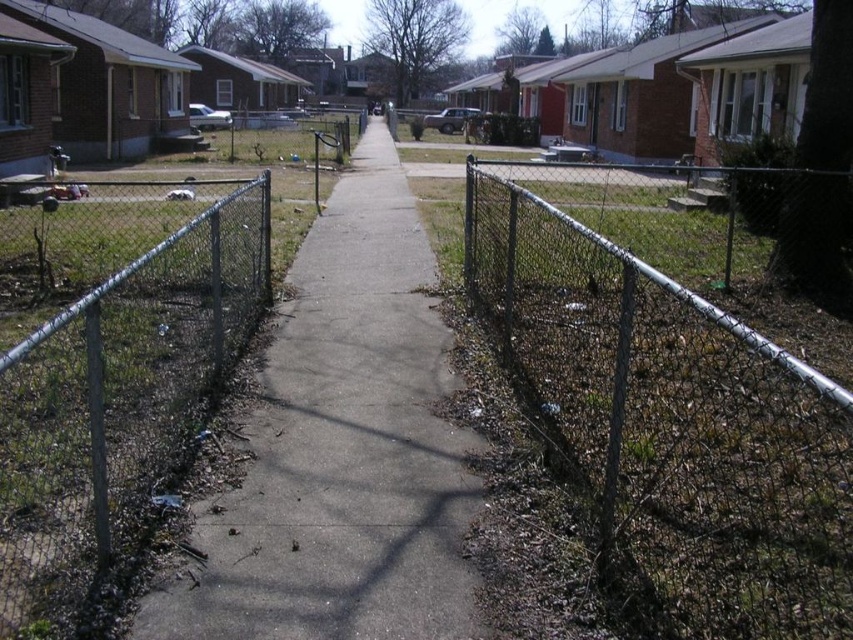
The width and height of the screenshot is (853, 640). What do you see at coordinates (670, 428) in the screenshot?
I see `metal chain-link fence at center` at bounding box center [670, 428].

In the scene shown: Is metal chain-link fence at center smaller than metal chain-link fence at left?

Actually, metal chain-link fence at center might be larger than metal chain-link fence at left.

Is point (654, 506) less distant than point (155, 468)?

That is True.

The height and width of the screenshot is (640, 853). I want to click on metal chain-link fence at center, so click(x=670, y=428).

Is point (392, 253) more distant than point (49, 364)?

Yes.

Does point (370, 234) come farther from viewer compared to point (141, 392)?

Yes, it is behind point (141, 392).

At what (x,y) coordinates should I click in order to perform the action: click on gray concrete sidewalk at center. Please return your answer as a coordinate pair (x, y). Looking at the image, I should click on (341, 449).

Who is more forward, [755,336] or [431,252]?

Point [755,336]

Does metal chain-link fence at center have a larger size compared to gray concrete sidewalk at center?

Incorrect, metal chain-link fence at center is not larger than gray concrete sidewalk at center.

Which is in front, point (502, 218) or point (467, 438)?

Point (467, 438) is in front.

You are a GUI agent. You are given a task and a screenshot of the screen. Output one action in this format:
    pyautogui.click(x=<x>, y=<y>)
    Task: Click on the metal chain-link fence at center
    
    Given the screenshot: What is the action you would take?
    pyautogui.click(x=670, y=428)